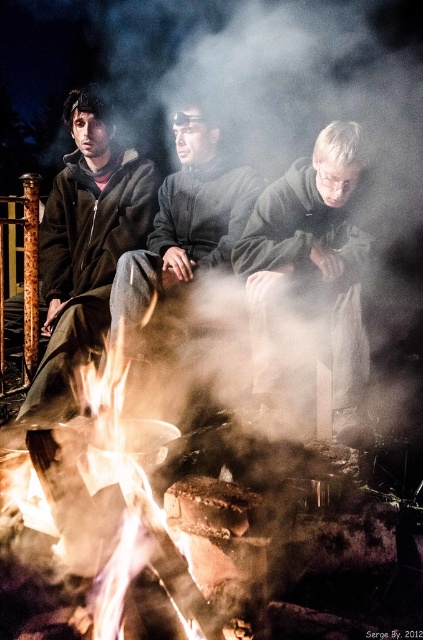
Can you confirm if matte black jacket at left is wider than dark gray woolen sweater at center?

No, matte black jacket at left is not wider than dark gray woolen sweater at center.

Which of these two, matte black jacket at left or dark gray woolen sweater at center, stands taller?

With more height is matte black jacket at left.

Between point (46, 228) and point (126, 278), which one is positioned behind?

Point (46, 228)

This screenshot has height=640, width=423. I want to click on matte black jacket at left, so click(85, 244).

At what (x,y) coordinates should I click in order to perform the action: click on matte black jacket at left. Please return your answer as a coordinate pair (x, y). Looking at the image, I should click on (85, 244).

Which is more to the left, matte black jacket at left or dark gray fleece jacket at center?

matte black jacket at left is more to the left.

Is point (90, 294) less distant than point (310, 248)?

No, it is behind (310, 248).

The image size is (423, 640). In order to click on matte black jacket at left in this screenshot , I will do `click(85, 244)`.

Which is behind, point (324, 257) or point (165, 260)?

The point (165, 260) is behind.

Is point (346, 131) less distant than point (222, 202)?

That is True.

Identify the location of dark gray fleece jacket at center. This screenshot has width=423, height=640. (318, 257).